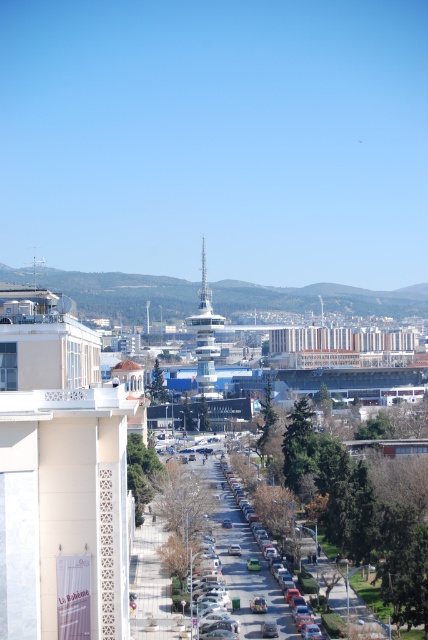
Between white textured balcony at center and matte silver car at center, which one is positioned higher?

white textured balcony at center

Is point (137, 413) positioned behind point (202, 586)?

Yes.

Between point (145, 419) and point (211, 579), which one is positioned behind?

Point (145, 419)

Image resolution: width=428 pixels, height=640 pixels. In order to click on white textured balcony at center in this screenshot , I will do `click(71, 403)`.